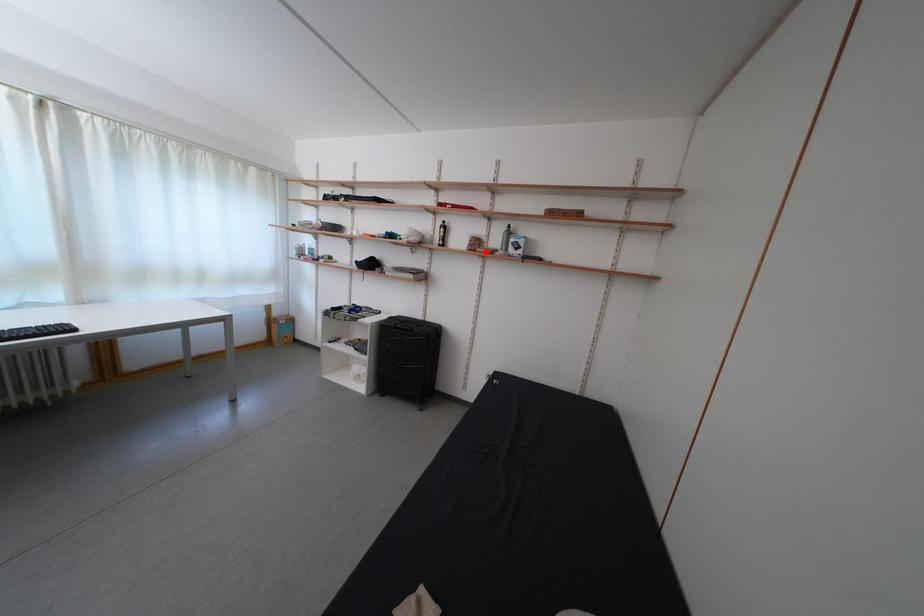
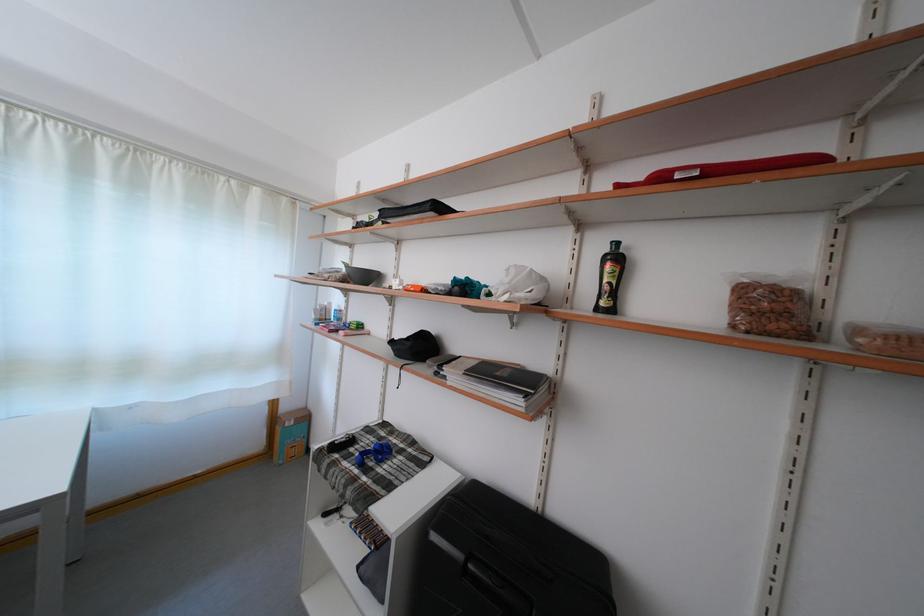
Find the pixel in the second image that matches the highlighted location in the first image.

(782, 321)